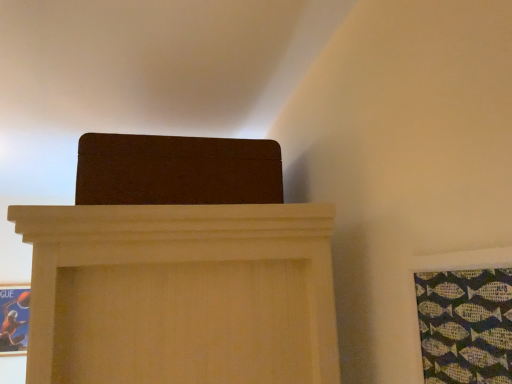
Image resolution: width=512 pixels, height=384 pixels. Describe the element at coordinates (181, 294) in the screenshot. I see `brown matte box at upper center` at that location.

Locate an element on the screen. The width and height of the screenshot is (512, 384). brown matte box at upper center is located at coordinates (181, 294).

Where is `brown matte box at upper center`? This screenshot has width=512, height=384. brown matte box at upper center is located at coordinates (181, 294).